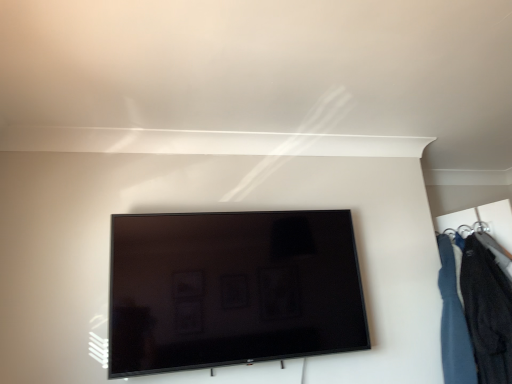
Question: Is black glossy tv at center in front of or behind velvet dark blue jacket at right in the image?

Choices:
 (A) behind
 (B) front

Answer: (B)

Question: From a real-world perspective, is black glossy tv at center above or below velvet dark blue jacket at right?

Choices:
 (A) below
 (B) above

Answer: (B)

Question: Visually, is black glossy tv at center positioned to the left or to the right of velvet dark blue jacket at right?

Choices:
 (A) left
 (B) right

Answer: (A)

Question: From a real-world perspective, is velvet dark blue jacket at right positioned above or below black glossy tv at center?

Choices:
 (A) above
 (B) below

Answer: (B)

Question: Is velvet dark blue jacket at right inside or outside of black glossy tv at center?

Choices:
 (A) outside
 (B) inside

Answer: (A)

Question: In terms of size, does velvet dark blue jacket at right appear bigger or smaller than black glossy tv at center?

Choices:
 (A) small
 (B) big

Answer: (A)

Question: Would you say velvet dark blue jacket at right is to the left or to the right of black glossy tv at center in the picture?

Choices:
 (A) right
 (B) left

Answer: (A)